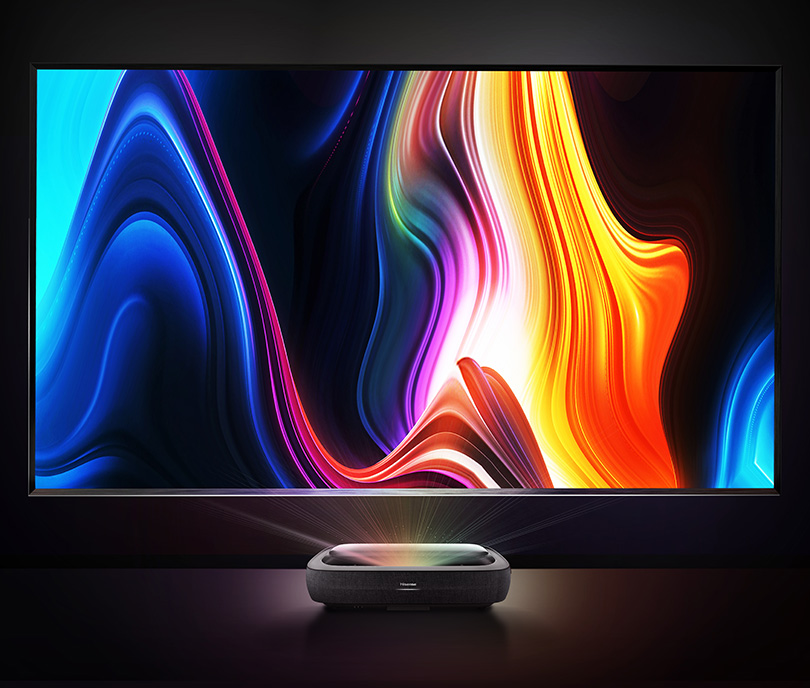
Identify the location of tv projector thing. (407, 598).